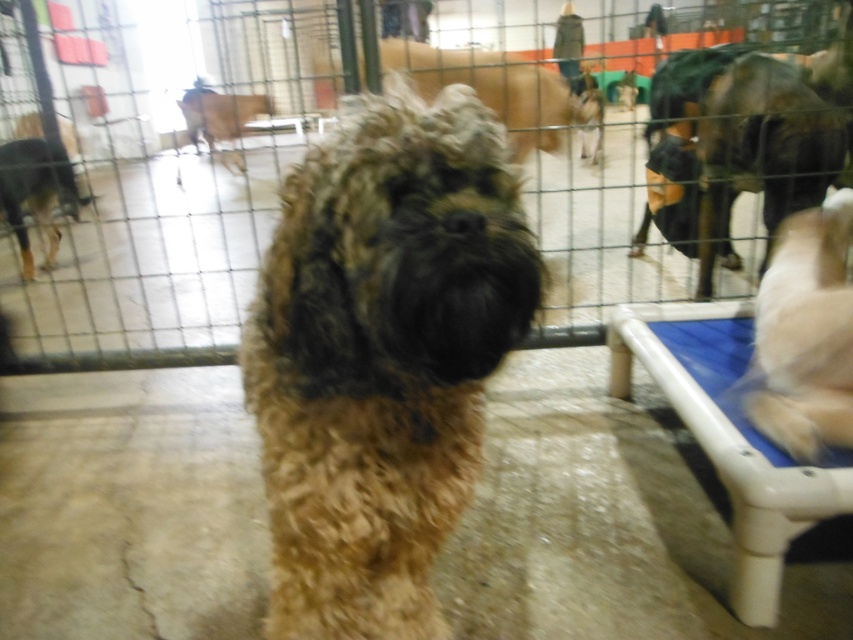
You are a dog trainer assessing the dogs in the kennel. You see the fuzzy brown dog at center and the black fur dog at left. Which dog would you expect to have a smaller size based on their appearance?

The fuzzy brown dog at center is smaller than the black fur dog at left, so it would be the one with the smaller size.

You are a photographer trying to capture a clear shot of the black fur dog at left through the metal wire fence at center. Based on the scene, can you determine if the fence will block your view of the dog?

The metal wire fence at center is positioned over the black fur dog at left, so the fence will block your view of the dog.

In the image of the dog in the fenced area, where is the white fluffy dog at right relative to the black fur dog at left?

The white fluffy dog at right is to the right of the black fur dog at left.